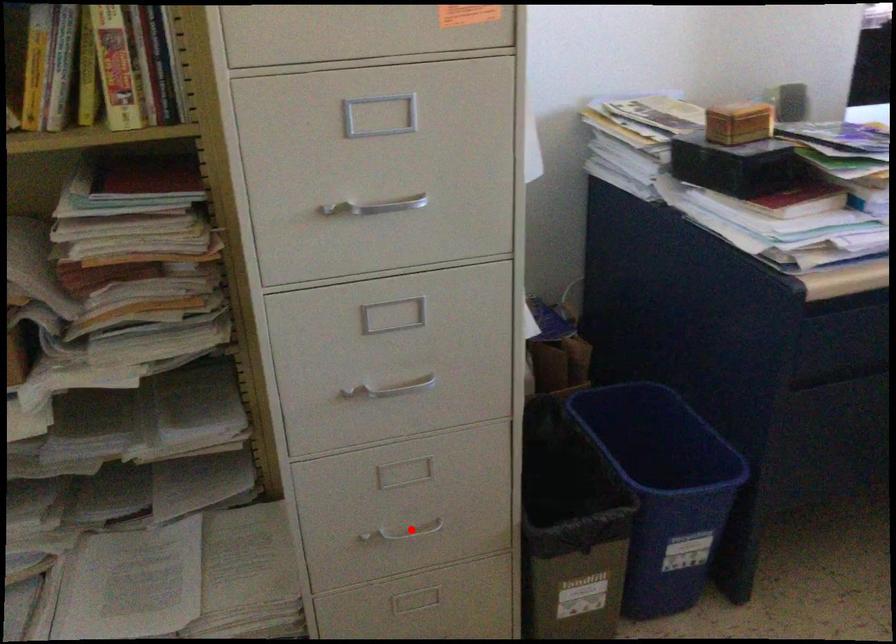
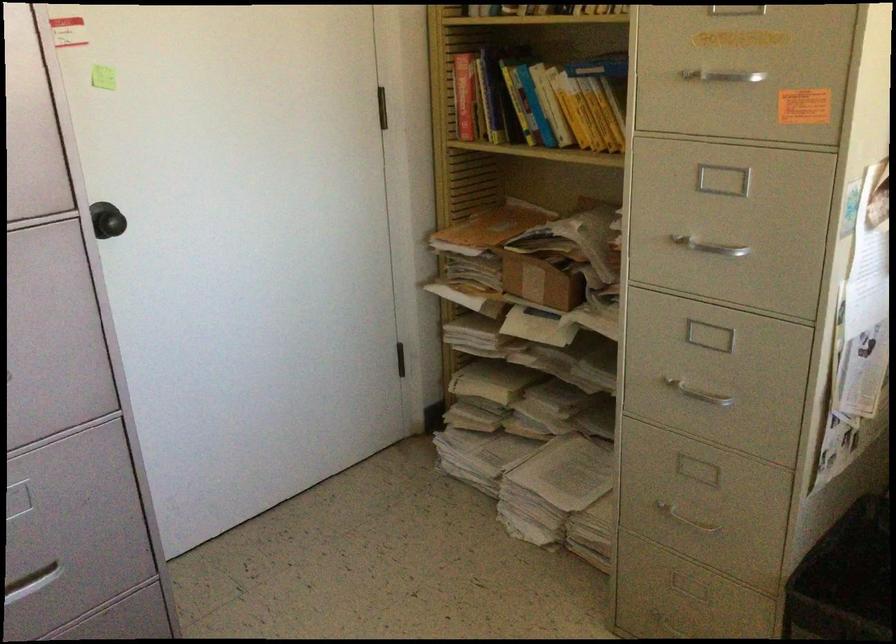
Find the pixel in the second image that matches the highlighted location in the first image.

(684, 518)